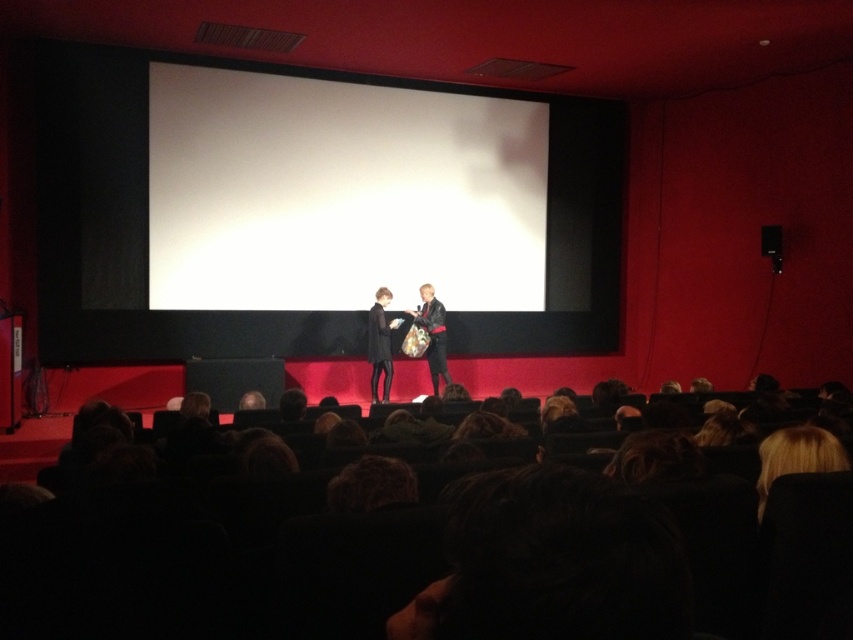
You are sitting in the movie theater and want to locate the black leather jacket at center. Can you tell me where exactly the point with coordinates (380, 342) is located in relation to the black leather jacket at center?

The point with coordinates (380, 342) is located on the black leather jacket at center.

You are organizing a small event in this theater and need to place a large banner between the leather jacket at center and the black plastic speaker at upper right. Given their sizes, which object should the banner be placed closer to?

The leather jacket at center is larger than the black plastic speaker at upper right, so the banner should be placed closer to the leather jacket at center to accommodate its size.